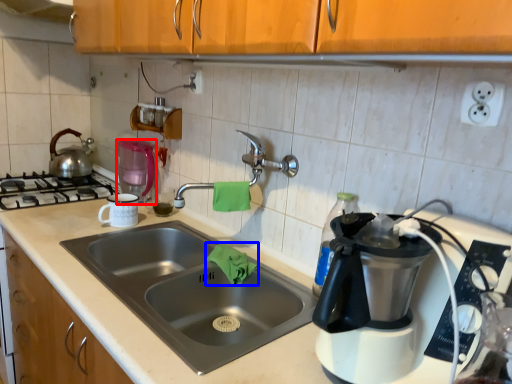
Question: Which object is further to the camera taking this photo, kitchen appliance (highlighted by a red box) or material (highlighted by a blue box)?

Choices:
 (A) kitchen appliance
 (B) material

Answer: (A)